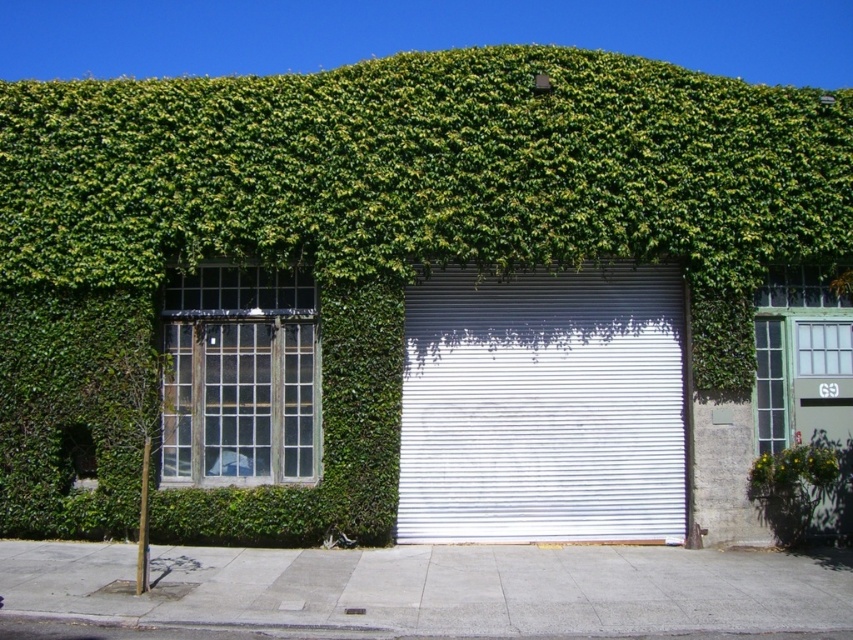
Between point (647, 362) and point (793, 468), which one is positioned in front?

Point (793, 468) is more forward.

Consider the image. Is white metallic garage door at center positioned before green leafy plant at lower right?

That is False.

You are a GUI agent. You are given a task and a screenshot of the screen. Output one action in this format:
    pyautogui.click(x=<x>, y=<y>)
    Task: Click on the white metallic garage door at center
    
    Given the screenshot: What is the action you would take?
    pyautogui.click(x=543, y=406)

Identify the location of white metallic garage door at center. (543, 406).